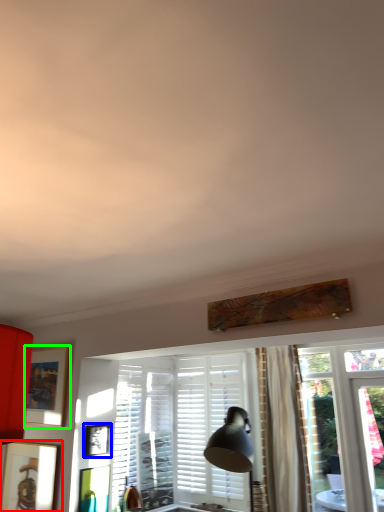
Question: Which object is positioned farthest from picture frame (highlighted by a red box)? Select from picture frame (highlighted by a blue box) and picture frame (highlighted by a green box).

Choices:
 (A) picture frame
 (B) picture frame

Answer: (A)